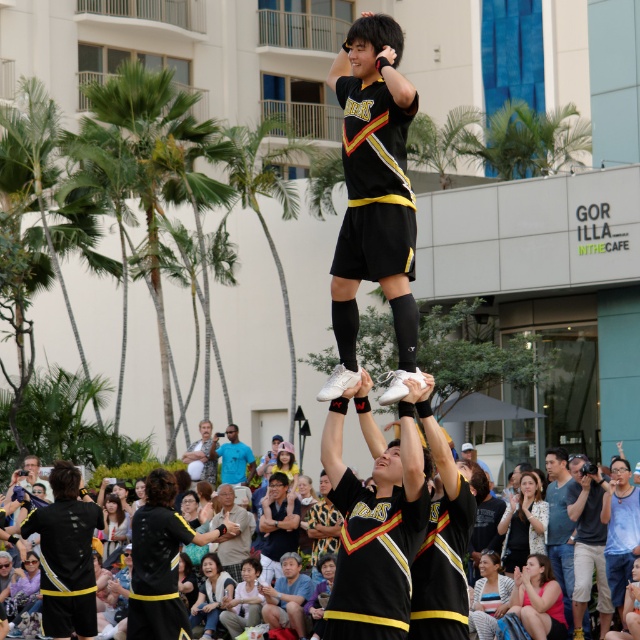
Question: Considering the real-world distances, which object is closest to the green leafy palm tree at left?

Choices:
 (A) beige textured shirt at center
 (B) blue t-shirt at center

Answer: (B)

Question: Can you confirm if white matte sneakers at center is wider than blue cotton shirt at center?

Choices:
 (A) no
 (B) yes

Answer: (B)

Question: Which of the following is the farthest from the observer?

Choices:
 (A) black cotton shirt at lower center
 (B) beige textured shirt at center

Answer: (B)

Question: Does green leafy palm tree at left have a larger size compared to blue cotton shirt at center?

Choices:
 (A) yes
 (B) no

Answer: (A)

Question: Among these points, which one is nearest to the camera?

Choices:
 (A) (236, 470)
 (B) (209, 122)
 (C) (406, 244)

Answer: (C)

Question: Where is green leafy palm tree at center located in relation to beige textured shirt at center in the image?

Choices:
 (A) above
 (B) below

Answer: (A)